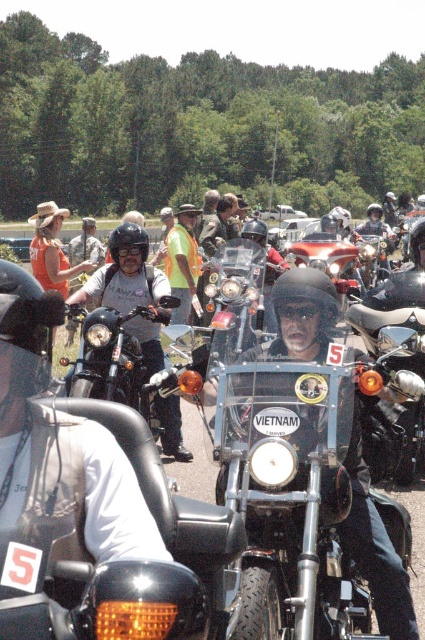
Question: Which point is farther to the camera?

Choices:
 (A) (306, 460)
 (B) (161, 349)

Answer: (B)

Question: Does metallic chrome motorcycle at center appear on the right side of matte black motorcycle at center?

Choices:
 (A) yes
 (B) no

Answer: (A)

Question: Does metallic chrome motorcycle at center appear over matte black motorcycle at center?

Choices:
 (A) no
 (B) yes

Answer: (A)

Question: Is metallic chrome motorcycle at center to the right of matte black motorcycle at center from the viewer's perspective?

Choices:
 (A) no
 (B) yes

Answer: (B)